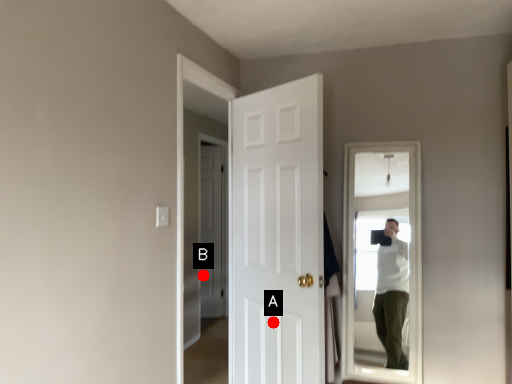
Question: Two points are circled on the image, labeled by A and B beside each circle. Which point is closer to the camera?

Choices:
 (A) A is closer
 (B) B is closer

Answer: (A)